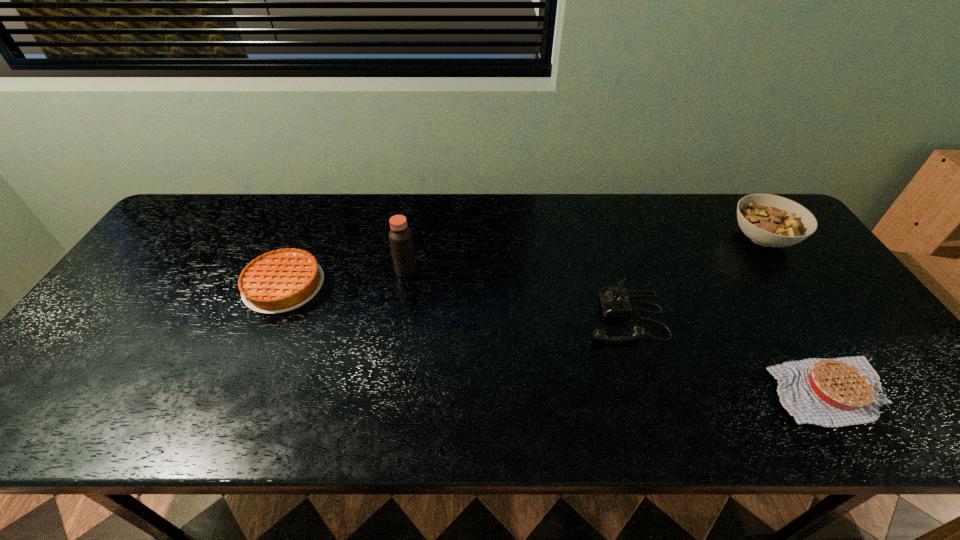
Where is `vacant space that's between the taller pie and the stew`? The width and height of the screenshot is (960, 540). vacant space that's between the taller pie and the stew is located at coordinates (523, 262).

You are a GUI agent. You are given a task and a screenshot of the screen. Output one action in this format:
    pyautogui.click(x=<x>, y=<y>)
    Task: Click on the free space that is in between the stew and the telephone
    
    Given the screenshot: What is the action you would take?
    pyautogui.click(x=694, y=278)

Find the location of a particular element. vacant space in between the shorter pie and the third tallest object is located at coordinates (728, 354).

I want to click on empty space between the fourth tallest object and the third tallest object, so click(x=455, y=301).

What are the coordinates of `free spot between the right pie and the stew` in the screenshot? It's located at (796, 315).

Point out which object is positioned as the third nearest to the shortest object. Please provide its 2D coordinates. Your answer should be formatted as a tuple, i.e. [(x, y)], where the tuple contains the x and y coordinates of a point satisfying the conditions above.

[(400, 236)]

Locate an element on the screen. the second closest object to the tallest object is located at coordinates (615, 303).

At what (x,y) coordinates should I click in order to perform the action: click on vacant space that satisfies the following two spatial constraints: 1. on the back side of the second tallest object; 2. on the right side of the vinegar. Please return your answer as a coordinate pair (x, y). Looking at the image, I should click on (411, 239).

Image resolution: width=960 pixels, height=540 pixels. Identify the location of free spot that satisfies the following two spatial constraints: 1. on the dial of the telephone; 2. on the right side of the nearest object. (648, 392).

Identify the location of free space that satisfies the following two spatial constraints: 1. on the back side of the fourth shortest object; 2. on the right side of the vinegar. point(411,239).